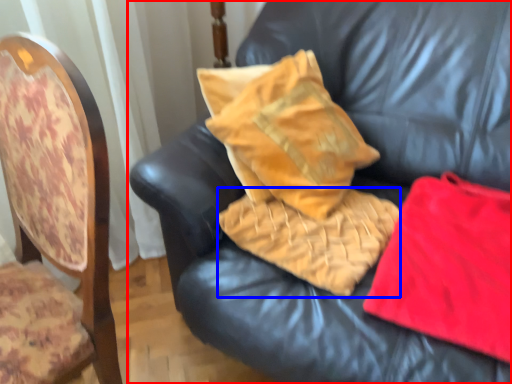
Question: Which of the following is the closest to the observer, furniture (highlighted by a red box) or material (highlighted by a blue box)?

Choices:
 (A) furniture
 (B) material

Answer: (A)